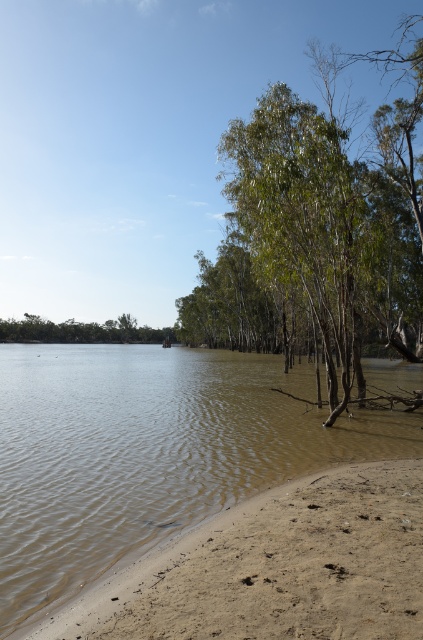
You are a hiker standing at the center of the image. You need to cross the river to reach the trees. Given the distance between the brown muddy water at lower left and the green leafy tree at lower left, can you safely cross the river without wading too far?

The brown muddy water at lower left and the green leafy tree at lower left are 114.36 meters apart. Since the distance is quite large, wading across the river might be risky due to the length of the crossing. It is advisable to look for a safer path or a bridge instead of attempting to cross directly.